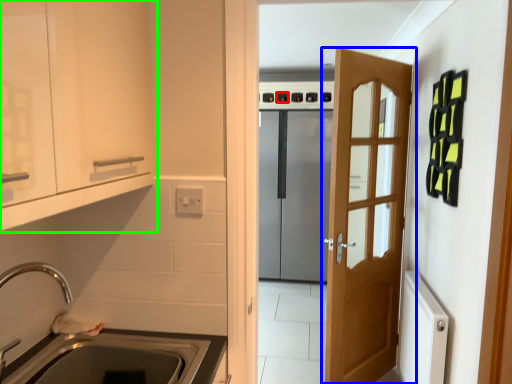
Question: Considering the real-world distances, which object is closest to knob (highlighted by a red box)? door (highlighted by a blue box) or cabinetry (highlighted by a green box).

Choices:
 (A) door
 (B) cabinetry

Answer: (A)